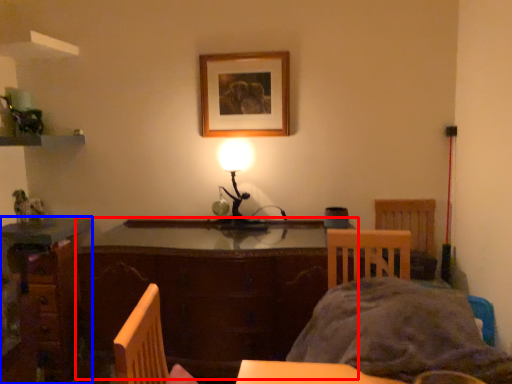
Question: Which object is further to the camera taking this photo, table (highlighted by a red box) or desk (highlighted by a blue box)?

Choices:
 (A) table
 (B) desk

Answer: (B)